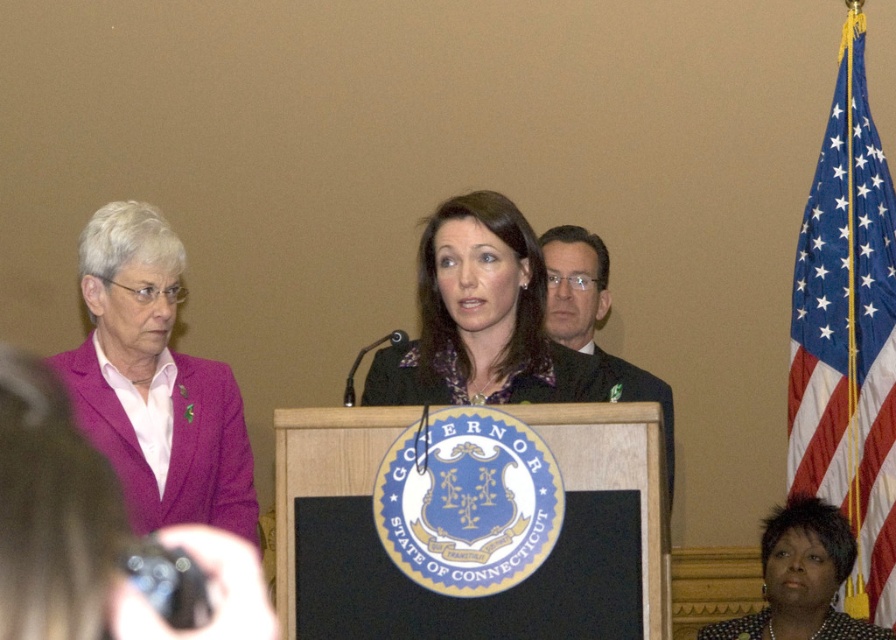
Question: Is blue fabric flag at right bigger than pink fabric jacket at left?

Choices:
 (A) yes
 (B) no

Answer: (B)

Question: Which of the following is the farthest from the observer?

Choices:
 (A) blue fabric flag at right
 (B) dark suit at center
 (C) matte black jacket at center
 (D) dark brown textured dress at lower right

Answer: (A)

Question: Can you confirm if blue fabric flag at right is bigger than dark suit at center?

Choices:
 (A) yes
 (B) no

Answer: (B)

Question: Which point appears closest to the camera in this image?

Choices:
 (A) (550, 275)
 (B) (890, 234)
 (C) (576, 394)

Answer: (C)

Question: Can you confirm if matte black jacket at center is thinner than dark brown textured dress at lower right?

Choices:
 (A) yes
 (B) no

Answer: (B)

Question: Which object is the closest to the dark brown textured dress at lower right?

Choices:
 (A) blue fabric flag at right
 (B) pink fabric jacket at left
 (C) matte black jacket at center

Answer: (A)